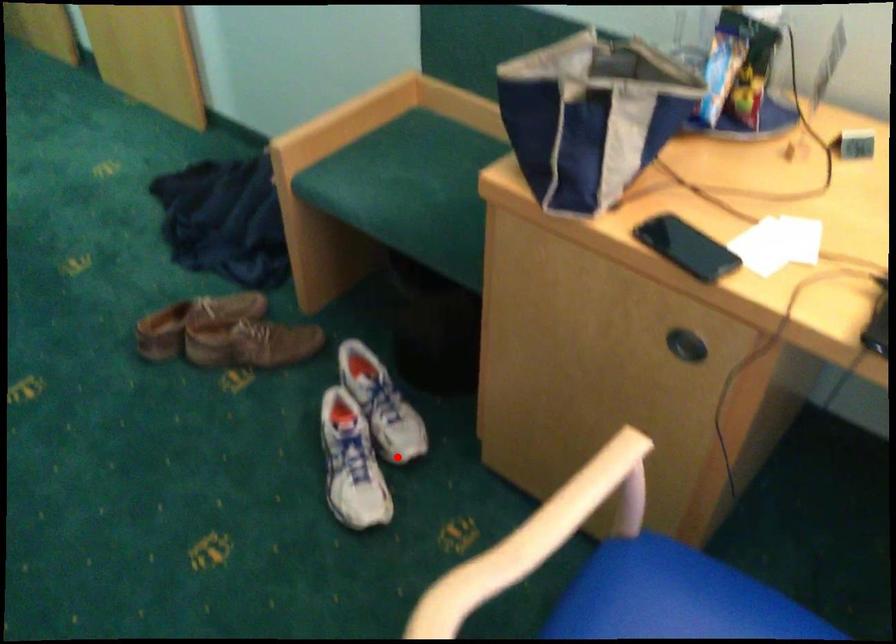
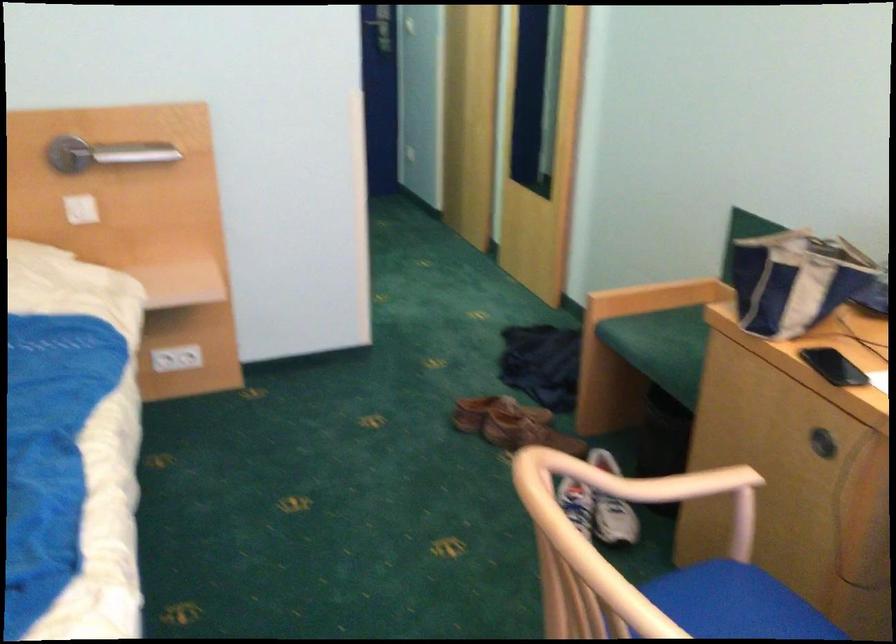
Question: A red point is marked in image1. In image2, is the corresponding 3D point closer to the camera or farther? Reply with the corresponding letter.

Choices:
 (A) The corresponding 3D point is closer.
 (B) The corresponding 3D point is farther.

Answer: (B)